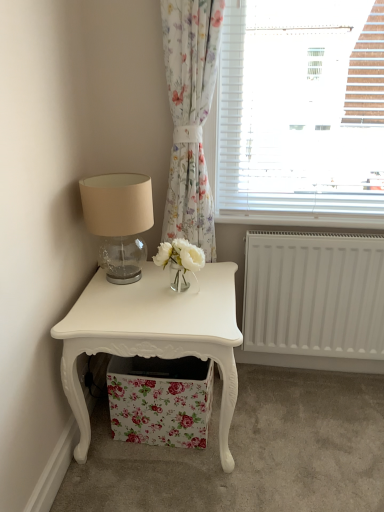
The image size is (384, 512). I want to click on white matte radiator at lower right, so click(315, 298).

Identify the location of floral fabric curtain at upper center. Image resolution: width=384 pixels, height=512 pixels. (190, 116).

In order to face floral fabric curtain at upper center, should I rotate leftwards or rightwards?

It's best to rotate right around 1.016 degrees.

The image size is (384, 512). What do you see at coordinates (119, 221) in the screenshot?
I see `matte glass table lamp at upper left` at bounding box center [119, 221].

In order to click on white matte radiator at lower right in this screenshot , I will do `click(315, 298)`.

In the image, is matte glass table lamp at upper left positioned in front of or behind floral fabric storage box at lower center?

matte glass table lamp at upper left is in front of floral fabric storage box at lower center.

Would you say matte glass table lamp at upper left is inside or outside floral fabric storage box at lower center?

matte glass table lamp at upper left is not enclosed by floral fabric storage box at lower center.

Is matte glass table lamp at upper left with floral fabric storage box at lower center?

No, matte glass table lamp at upper left is not touching floral fabric storage box at lower center.

Looking at this image, from a real-world perspective, relative to floral fabric storage box at lower center, is matte glass table lamp at upper left vertically above or below?

matte glass table lamp at upper left is above floral fabric storage box at lower center.

From a real-world perspective, between floral fabric storage box at lower center and white plastic radiator at lower center, who is vertically lower?

floral fabric storage box at lower center.

Considering the positions of objects floral fabric storage box at lower center and white plastic radiator at lower center in the image provided, who is in front, floral fabric storage box at lower center or white plastic radiator at lower center?

floral fabric storage box at lower center is more forward.

Is floral fabric storage box at lower center turned away from white plastic radiator at lower center?

floral fabric storage box at lower center is not turned away from white plastic radiator at lower center.

Between floral fabric storage box at lower center and white plastic radiator at lower center, which one has smaller size?

white plastic radiator at lower center.

From a real-world perspective, between white glossy nightstand at lower left and floral fabric curtain at upper center, who is vertically higher?

floral fabric curtain at upper center is physically above.

Considering the relative sizes of white glossy nightstand at lower left and floral fabric curtain at upper center in the image provided, is white glossy nightstand at lower left smaller than floral fabric curtain at upper center?

Incorrect, white glossy nightstand at lower left is not smaller in size than floral fabric curtain at upper center.

Where is `nightstand that appears in front of the floral fabric curtain at upper center`? nightstand that appears in front of the floral fabric curtain at upper center is located at coordinates (154, 334).

Can you tell me how much white glossy nightstand at lower left and floral fabric curtain at upper center differ in facing direction?

The angle between the facing direction of white glossy nightstand at lower left and the facing direction of floral fabric curtain at upper center is 3.2 degrees.

In the scene shown: From the image's perspective, between white plastic radiator at lower center and white matte radiator at lower right, who is located below?

white matte radiator at lower right, from the image's perspective.

Considering the relative positions of white plastic radiator at lower center and white matte radiator at lower right in the image provided, is white plastic radiator at lower center to the left or to the right of white matte radiator at lower right?

Clearly, white plastic radiator at lower center is on the left of white matte radiator at lower right in the image.

Is white plastic radiator at lower center turned away from white matte radiator at lower right?

white plastic radiator at lower center is not turned away from white matte radiator at lower right.

Does white plastic radiator at lower center have a lesser width compared to white matte radiator at lower right?

No, white plastic radiator at lower center is not thinner than white matte radiator at lower right.

From the image's perspective, would you say white plastic radiator at lower center is positioned over floral fabric storage box at lower center?

Yes.

Relative to floral fabric storage box at lower center, is white plastic radiator at lower center in front or behind?

white plastic radiator at lower center is behind floral fabric storage box at lower center.

Which is closer, (304, 218) or (165, 365)?

The point (165, 365) is more forward.

From a real-world perspective, does white plastic radiator at lower center stand above floral fabric storage box at lower center?

Yes, from a real-world perspective, white plastic radiator at lower center is above floral fabric storage box at lower center.

From the image's perspective, is floral fabric curtain at upper center positioned above or below matte glass table lamp at upper left?

Clearly, from the image's perspective, floral fabric curtain at upper center is above matte glass table lamp at upper left.

Does point (179, 42) appear closer or farther from the camera than point (118, 185)?

Point (179, 42) is positioned farther from the camera compared to point (118, 185).

Can you tell me how much floral fabric curtain at upper center and matte glass table lamp at upper left differ in facing direction?

The facing directions of floral fabric curtain at upper center and matte glass table lamp at upper left are 3.09 degrees apart.

Consider the image. Which of these two, floral fabric curtain at upper center or matte glass table lamp at upper left, stands taller?

Standing taller between the two is floral fabric curtain at upper center.

Is white glossy nightstand at lower left positioned behind floral fabric storage box at lower center?

No, white glossy nightstand at lower left is closer to the camera.

From the picture: Is white glossy nightstand at lower left turned away from floral fabric storage box at lower center?

Yes, white glossy nightstand at lower left's orientation is away from floral fabric storage box at lower center.

From a real-world perspective, is white glossy nightstand at lower left located higher than floral fabric storage box at lower center?

Indeed, from a real-world perspective, white glossy nightstand at lower left stands above floral fabric storage box at lower center.

Between white glossy nightstand at lower left and floral fabric storage box at lower center, which one has less height?

Standing shorter between the two is floral fabric storage box at lower center.

Where is `table lamp lying on the left of floral fabric storage box at lower center`? The height and width of the screenshot is (512, 384). table lamp lying on the left of floral fabric storage box at lower center is located at coordinates (119, 221).

Where is `window sill above the floral fabric storage box at lower center (from the image's perspective)`? window sill above the floral fabric storage box at lower center (from the image's perspective) is located at coordinates (301, 219).

From the image, which object appears to be nearer to white glossy nightstand at lower left, matte glass table lamp at upper left or white matte radiator at lower right?

matte glass table lamp at upper left lies closer to white glossy nightstand at lower left than the other object.

Looking at the image, which one is located further to white glossy nightstand at lower left, floral fabric curtain at upper center or floral fabric storage box at lower center?

Among the two, floral fabric curtain at upper center is located further to white glossy nightstand at lower left.

Which object lies nearer to the anchor point white plastic radiator at lower center, white glossy nightstand at lower left or matte glass table lamp at upper left?

Among the two, matte glass table lamp at upper left is located nearer to white plastic radiator at lower center.

Estimate the real-world distances between objects in this image. Which object is closer to floral fabric storage box at lower center, floral fabric curtain at upper center or white matte radiator at lower right?

Based on the image, white matte radiator at lower right appears to be nearer to floral fabric storage box at lower center.

Looking at the image, which one is located further to matte glass table lamp at upper left, floral fabric storage box at lower center or white plastic radiator at lower center?

white plastic radiator at lower center.

Looking at the image, which one is located further to floral fabric curtain at upper center, white glossy nightstand at lower left or white plastic radiator at lower center?

white glossy nightstand at lower left lies further to floral fabric curtain at upper center than the other object.

From the picture: When comparing their distances from white matte radiator at lower right, does matte glass table lamp at upper left or floral fabric storage box at lower center seem closer?

Based on the image, floral fabric storage box at lower center appears to be nearer to white matte radiator at lower right.

Looking at this image, based on their spatial positions, is floral fabric curtain at upper center or matte glass table lamp at upper left closer to white matte radiator at lower right?

Based on the image, floral fabric curtain at upper center appears to be nearer to white matte radiator at lower right.

The height and width of the screenshot is (512, 384). Identify the location of radiator between floral fabric curtain at upper center and white glossy nightstand at lower left vertically. (315, 298).

At what (x,y) coordinates should I click in order to perform the action: click on window sill between floral fabric curtain at upper center and floral fabric storage box at lower center vertically. Please return your answer as a coordinate pair (x, y). The image size is (384, 512). Looking at the image, I should click on (301, 219).

Image resolution: width=384 pixels, height=512 pixels. In order to click on nightstand between matte glass table lamp at upper left and floral fabric storage box at lower center from top to bottom in this screenshot , I will do `click(154, 334)`.

Locate an element on the screen. curtain located between matte glass table lamp at upper left and white plastic radiator at lower center in the left-right direction is located at coordinates (190, 116).